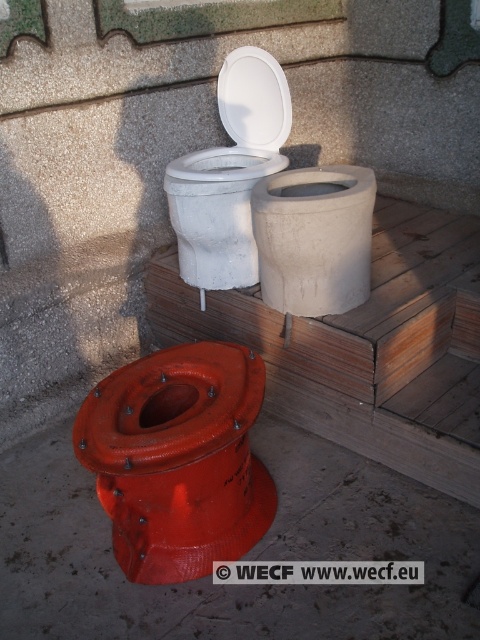
Does orange glossy toilet bowl at lower center have a larger size compared to white glossy toilet lid at upper center?

Yes, orange glossy toilet bowl at lower center is bigger than white glossy toilet lid at upper center.

Who is lower down, orange glossy toilet bowl at lower center or white glossy toilet lid at upper center?

Positioned lower is orange glossy toilet bowl at lower center.

Where is `orange glossy toilet bowl at lower center`? This screenshot has height=640, width=480. orange glossy toilet bowl at lower center is located at coordinates (178, 460).

This screenshot has width=480, height=640. Find the location of `orange glossy toilet bowl at lower center`. orange glossy toilet bowl at lower center is located at coordinates (178, 460).

What do you see at coordinates (178, 460) in the screenshot?
I see `orange glossy toilet bowl at lower center` at bounding box center [178, 460].

Is orange glossy toilet bowl at lower center thinner than matte concrete toilet bowl at center?

Incorrect, orange glossy toilet bowl at lower center's width is not less than matte concrete toilet bowl at center's.

At what (x,y) coordinates should I click in order to perform the action: click on orange glossy toilet bowl at lower center. Please return your answer as a coordinate pair (x, y). The height and width of the screenshot is (640, 480). Looking at the image, I should click on (178, 460).

Can you confirm if matte concrete toilet bowl at center is taller than white matte toilet bowl at upper center?

No.

Which is more to the left, matte concrete toilet bowl at center or white matte toilet bowl at upper center?

white matte toilet bowl at upper center is more to the left.

Which is in front, point (347, 305) or point (212, 236)?

Point (347, 305) is more forward.

Where is `matte concrete toilet bowl at center`? Image resolution: width=480 pixels, height=640 pixels. matte concrete toilet bowl at center is located at coordinates (313, 237).